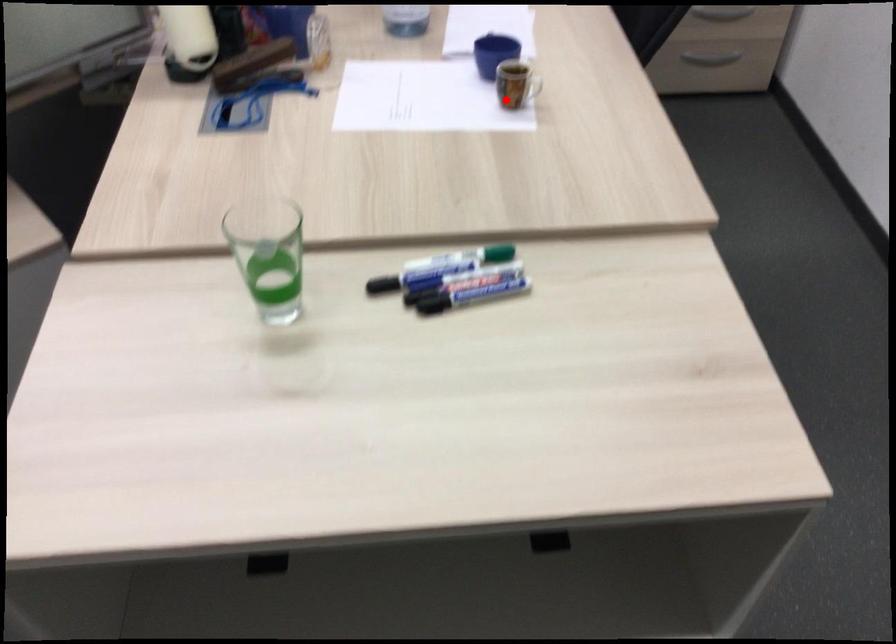
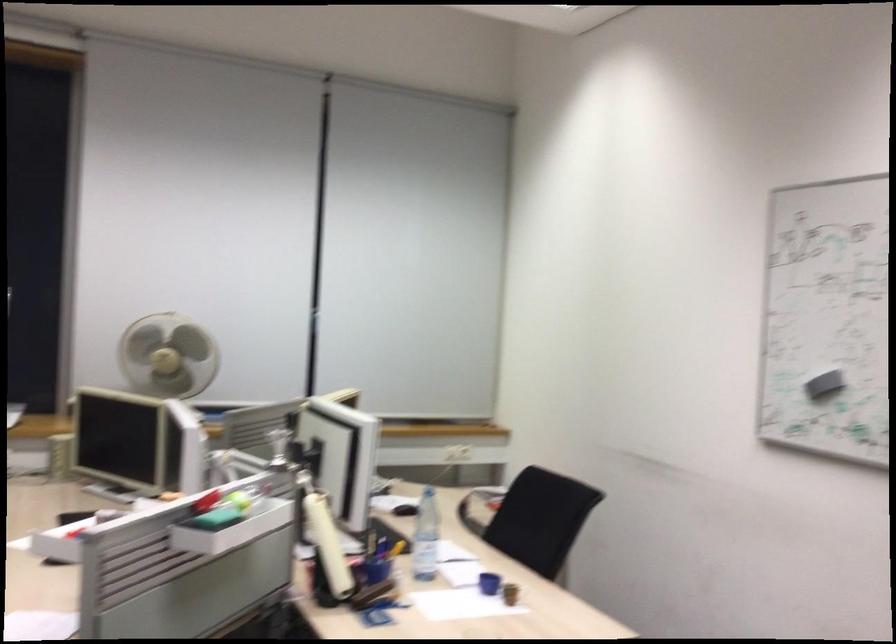
Locate, in the second image, the point that corresponds to the highlighted location in the first image.

(510, 592)